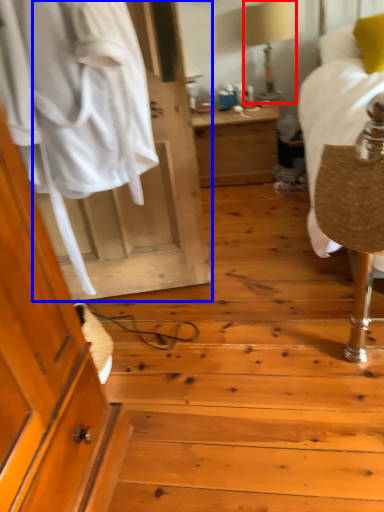
Question: Which object is closer to the camera taking this photo, table lamp (highlighted by a red box) or door (highlighted by a blue box)?

Choices:
 (A) table lamp
 (B) door

Answer: (B)